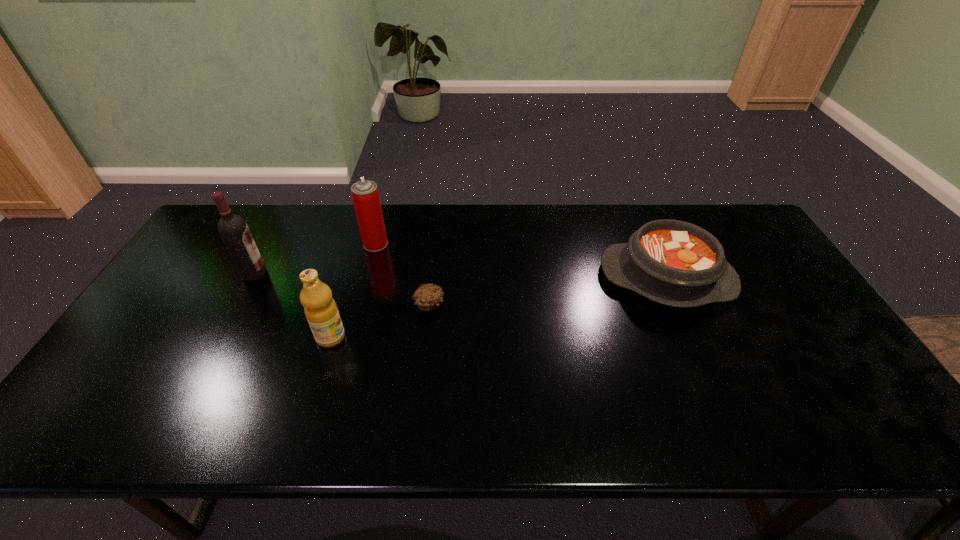
The width and height of the screenshot is (960, 540). Find the location of `vacant region between the aerosol can and the casserole`. vacant region between the aerosol can and the casserole is located at coordinates (521, 261).

Locate an element on the screen. free point between the leftmost object and the muffin is located at coordinates (342, 289).

The height and width of the screenshot is (540, 960). I want to click on free spot between the olive oil and the aerosol can, so click(x=353, y=291).

At what (x,y) coordinates should I click in order to perform the action: click on free spot between the casserole and the aerosol can. Please return your answer as a coordinate pair (x, y). The image size is (960, 540). Looking at the image, I should click on (521, 261).

Identify the location of free space between the olive oil and the rightmost object. The image size is (960, 540). click(498, 307).

Find the location of `free space between the second shortest object and the olive oil`. free space between the second shortest object and the olive oil is located at coordinates (498, 307).

This screenshot has width=960, height=540. Find the location of `empty space that is in between the aerosol can and the casserole`. empty space that is in between the aerosol can and the casserole is located at coordinates (521, 261).

Image resolution: width=960 pixels, height=540 pixels. I want to click on free spot between the nearest object and the shortest object, so click(x=380, y=321).

Identify which object is located as the nearest to the shortest object. Please provide its 2D coordinates. Your answer should be formatted as a tuple, i.e. [(x, y)], where the tuple contains the x and y coordinates of a point satisfying the conditions above.

[(321, 311)]

Find the location of a particular element. the second closest object to the shortest object is located at coordinates (365, 194).